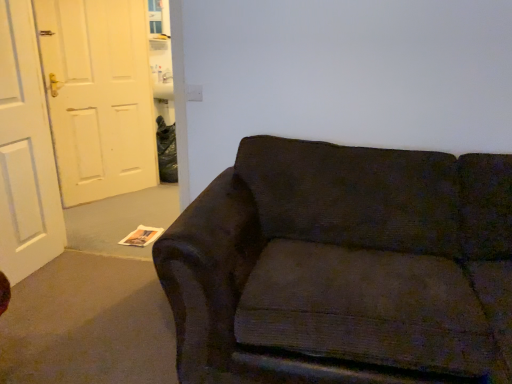
Question: Could you tell me if dark fabric couch at center is turned towards white matte door at left, arranged as the second door when viewed from the back?

Choices:
 (A) yes
 (B) no

Answer: (B)

Question: Is dark fabric couch at center positioned far away from white matte door at left, arranged as the second door when viewed from the back?

Choices:
 (A) yes
 (B) no

Answer: (A)

Question: Does dark fabric couch at center have a greater width compared to white matte door at left, the first door in the front-to-back sequence?

Choices:
 (A) no
 (B) yes

Answer: (B)

Question: Is dark fabric couch at center looking in the opposite direction of white matte door at left, arranged as the second door when viewed from the back?

Choices:
 (A) no
 (B) yes

Answer: (A)

Question: From the image's perspective, is dark fabric couch at center over white matte door at left, arranged as the second door when viewed from the back?

Choices:
 (A) yes
 (B) no

Answer: (B)

Question: From a real-world perspective, does dark fabric couch at center stand above white matte door at left, arranged as the second door when viewed from the back?

Choices:
 (A) no
 (B) yes

Answer: (A)

Question: Does white matte door at left, which is counted as the second door, starting from the front, come in front of white matte door at left, the first door in the front-to-back sequence?

Choices:
 (A) yes
 (B) no

Answer: (B)

Question: Is white matte door at left, arranged as the second door when viewed from the back, surrounded by white matte door at left, which is counted as the second door, starting from the front?

Choices:
 (A) no
 (B) yes

Answer: (A)

Question: Does white matte door at left, which is counted as the second door, starting from the front, have a smaller size compared to white matte door at left, the first door in the front-to-back sequence?

Choices:
 (A) yes
 (B) no

Answer: (B)

Question: Does white matte door at left, the 1th door positioned from the back, have a greater height compared to white matte door at left, the first door in the front-to-back sequence?

Choices:
 (A) no
 (B) yes

Answer: (B)

Question: From the image's perspective, is white matte door at left, which is counted as the second door, starting from the front, located above white matte door at left, the first door in the front-to-back sequence?

Choices:
 (A) no
 (B) yes

Answer: (B)

Question: Is white matte door at left, the 1th door positioned from the back, further to the viewer compared to white matte door at left, the first door in the front-to-back sequence?

Choices:
 (A) no
 (B) yes

Answer: (B)

Question: Considering the relative sizes of white matte door at left, the 1th door positioned from the back, and dark fabric couch at center in the image provided, is white matte door at left, the 1th door positioned from the back, wider than dark fabric couch at center?

Choices:
 (A) yes
 (B) no

Answer: (B)